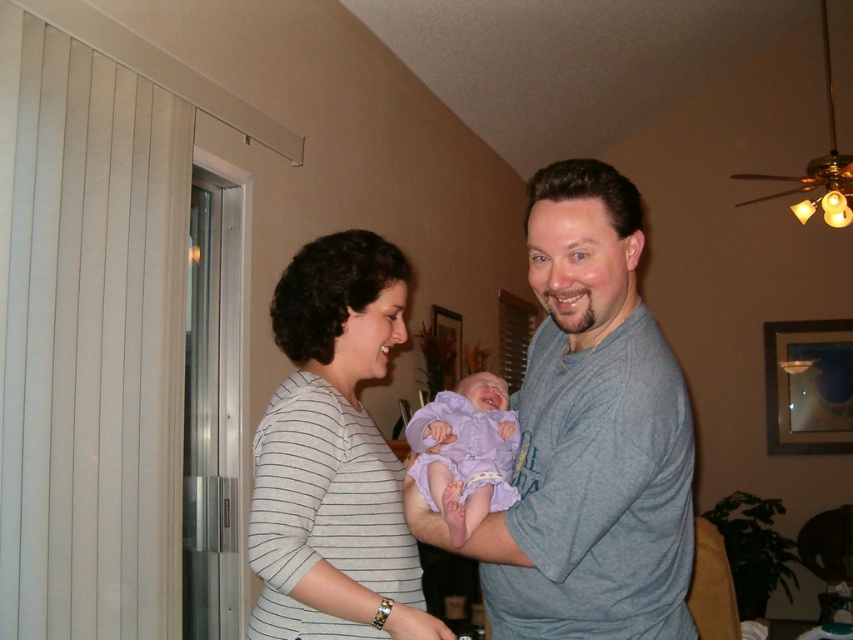
Question: Among these objects, which one is farthest from the camera?

Choices:
 (A) white striped shirt at center
 (B) gray cotton shirt at center

Answer: (A)

Question: Does white striped shirt at center appear on the left side of purple satin baby at center?

Choices:
 (A) no
 (B) yes

Answer: (B)

Question: Is gray cotton shirt at center bigger than purple satin baby at center?

Choices:
 (A) yes
 (B) no

Answer: (A)

Question: Is gray cotton shirt at center wider than purple satin baby at center?

Choices:
 (A) yes
 (B) no

Answer: (A)

Question: Which object appears farthest from the camera in this image?

Choices:
 (A) purple satin baby at center
 (B) white striped shirt at center

Answer: (B)

Question: Which object appears farthest from the camera in this image?

Choices:
 (A) gray cotton shirt at center
 (B) purple satin baby at center
 (C) white striped shirt at center

Answer: (C)